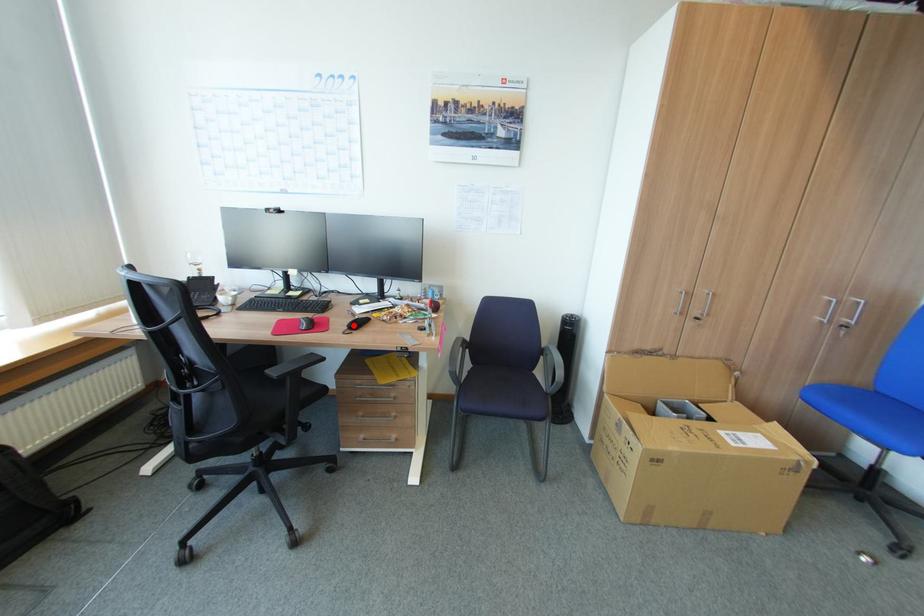
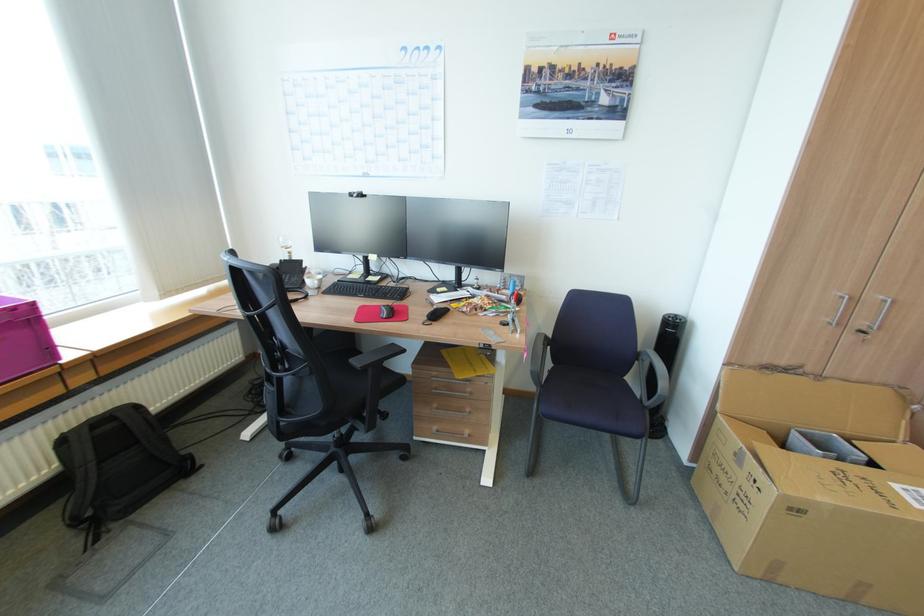
The point at the highlighted location is marked in the first image. Where is the corresponding point in the second image?

(432, 315)